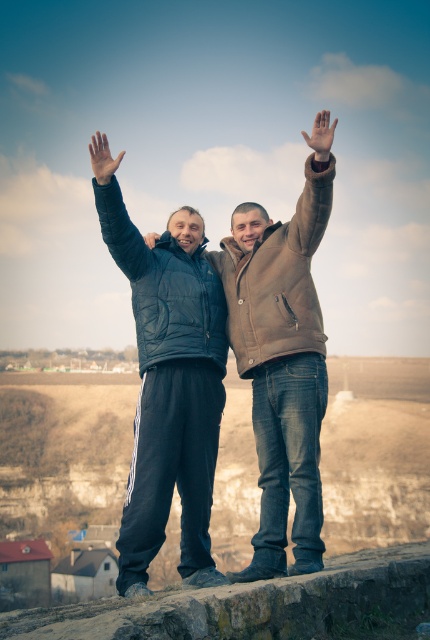
You are standing at the camera position and want to reach the point marked as point (144,492). If your walking speed is 1.5 meters per second, how many seconds will it take you to reach that point?

The distance between the camera and point (144,492) is 41.13 meters. At a speed of 1.5 meters per second, it will take approximately 27.42 seconds to reach the point.

You are a photographer trying to capture the perfect shot of the two people in the scene. You notice the brown leather jacket at upper center and the matte black hand at upper center. Which object is positioned higher in the frame?

The matte black hand at upper center is positioned higher in the frame than the brown leather jacket at upper center because the brown leather jacket at upper center is shorter than the matte black hand at upper center.